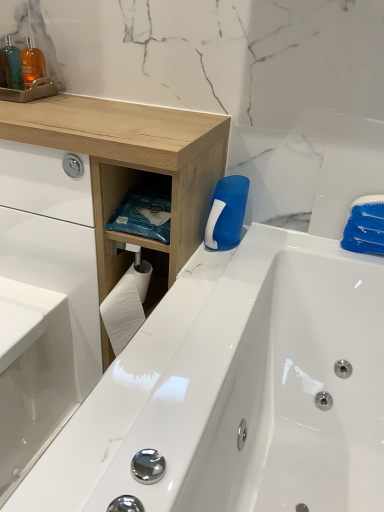
The height and width of the screenshot is (512, 384). I want to click on free spot to the right of translucent plastic bottle at upper left, so click(61, 97).